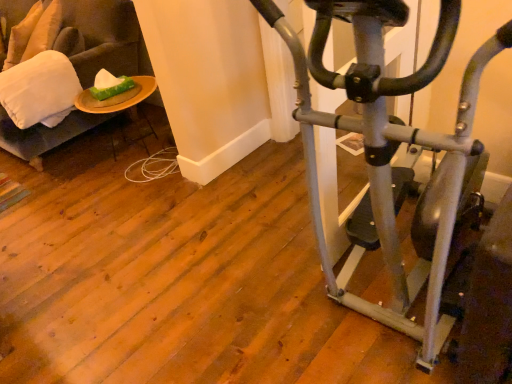
Question: Is velvet beige swivel chair at left to the left or to the right of silver metallic stationary bicycle at right in the image?

Choices:
 (A) left
 (B) right

Answer: (A)

Question: Looking at their shapes, would you say velvet beige swivel chair at left is wider or thinner than silver metallic stationary bicycle at right?

Choices:
 (A) wide
 (B) thin

Answer: (A)

Question: Which object is positioned farthest from the wooden plate at left?

Choices:
 (A) velvet beige swivel chair at left
 (B) white soft pillow at left, the 2th pillow from the top
 (C) silver metallic stationary bicycle at right
 (D) green matte tissue at upper left
 (E) soft beige pillow at upper left, marked as the second pillow in a right-to-left arrangement

Answer: (C)

Question: Which object is positioned farthest from the green matte tissue at upper left?

Choices:
 (A) silver metallic stationary bicycle at right
 (B) soft beige pillow at upper left, positioned as the first pillow in back-to-front order
 (C) velvet beige swivel chair at left
 (D) wooden plate at left
 (E) white soft pillow at left, arranged as the first pillow when viewed from the front

Answer: (A)